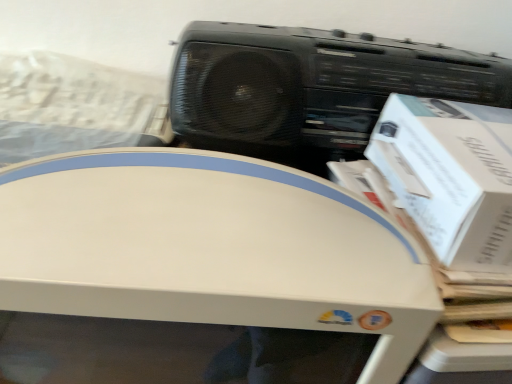
Question: Does white cardboard box at right appear on the right side of white plastic printer at center?

Choices:
 (A) yes
 (B) no

Answer: (A)

Question: Is white cardboard box at right further to camera compared to white plastic printer at center?

Choices:
 (A) no
 (B) yes

Answer: (B)

Question: Can you confirm if white cardboard box at right is wider than white plastic printer at center?

Choices:
 (A) yes
 (B) no

Answer: (B)

Question: Does white cardboard box at right have a lesser height compared to white plastic printer at center?

Choices:
 (A) no
 (B) yes

Answer: (B)

Question: Does white cardboard box at right lie in front of white plastic printer at center?

Choices:
 (A) yes
 (B) no

Answer: (B)

Question: Is white cardboard box at right turned away from white plastic printer at center?

Choices:
 (A) yes
 (B) no

Answer: (B)

Question: Does white plastic printer at center have a lesser width compared to black plastic cassette at upper right?

Choices:
 (A) no
 (B) yes

Answer: (A)

Question: From a real-world perspective, is white plastic printer at center located beneath black plastic cassette at upper right?

Choices:
 (A) yes
 (B) no

Answer: (A)

Question: Is white plastic printer at center further to the viewer compared to black plastic cassette at upper right?

Choices:
 (A) no
 (B) yes

Answer: (A)

Question: Considering the relative positions of white plastic printer at center and black plastic cassette at upper right in the image provided, is white plastic printer at center to the right of black plastic cassette at upper right from the viewer's perspective?

Choices:
 (A) no
 (B) yes

Answer: (A)

Question: Is white plastic printer at center with black plastic cassette at upper right?

Choices:
 (A) yes
 (B) no

Answer: (B)

Question: Is white plastic printer at center bigger than black plastic cassette at upper right?

Choices:
 (A) yes
 (B) no

Answer: (A)

Question: Is black plastic cassette at upper right looking in the opposite direction of white plastic printer at center?

Choices:
 (A) no
 (B) yes

Answer: (A)